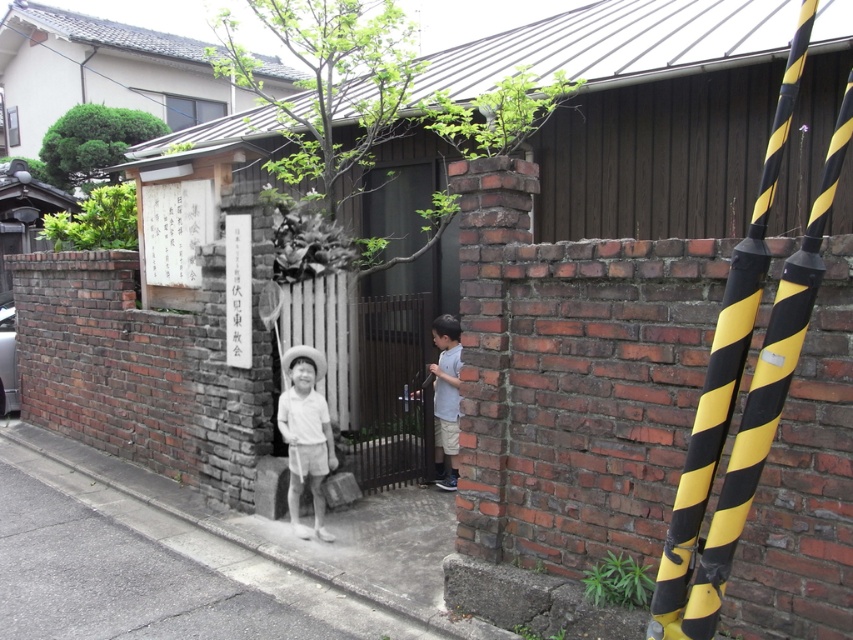
Question: Which object appears closest to the camera in this image?

Choices:
 (A) light blue cotton shirt at center
 (B) concrete sidewalk at lower left
 (C) dark brown metal gate at center
 (D) white cotton shorts at center

Answer: (B)

Question: Which point is farther to the camera?

Choices:
 (A) (71, 468)
 (B) (310, 452)

Answer: (A)

Question: Is concrete sidewalk at lower left closer to camera compared to light blue cotton shirt at center?

Choices:
 (A) yes
 (B) no

Answer: (A)

Question: Observing the image, what is the correct spatial positioning of black/yellow striped pole at right in reference to green leafy tree at upper left?

Choices:
 (A) left
 (B) right

Answer: (B)

Question: Can you confirm if green leafy tree at upper left is thinner than light blue cotton shirt at center?

Choices:
 (A) no
 (B) yes

Answer: (A)

Question: Among these points, which one is farthest from the camera?

Choices:
 (A) (395, 627)
 (B) (114, 172)

Answer: (B)